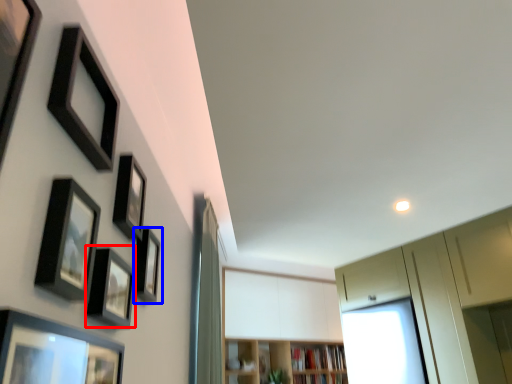
Question: Which of the following is the closest to the observer, picture frame (highlighted by a red box) or picture frame (highlighted by a blue box)?

Choices:
 (A) picture frame
 (B) picture frame

Answer: (A)